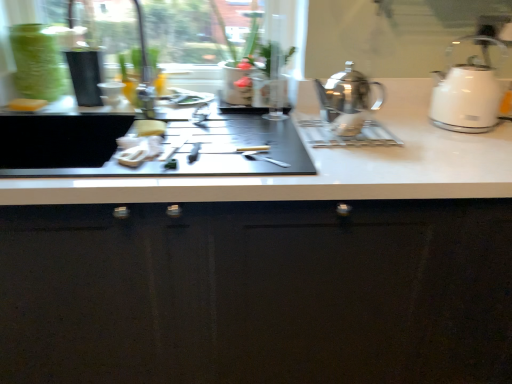
The width and height of the screenshot is (512, 384). Find the location of `free space in front of shiny metallic kettle at center, which appears as the first kettle when viewed from the left`. free space in front of shiny metallic kettle at center, which appears as the first kettle when viewed from the left is located at coordinates (352, 155).